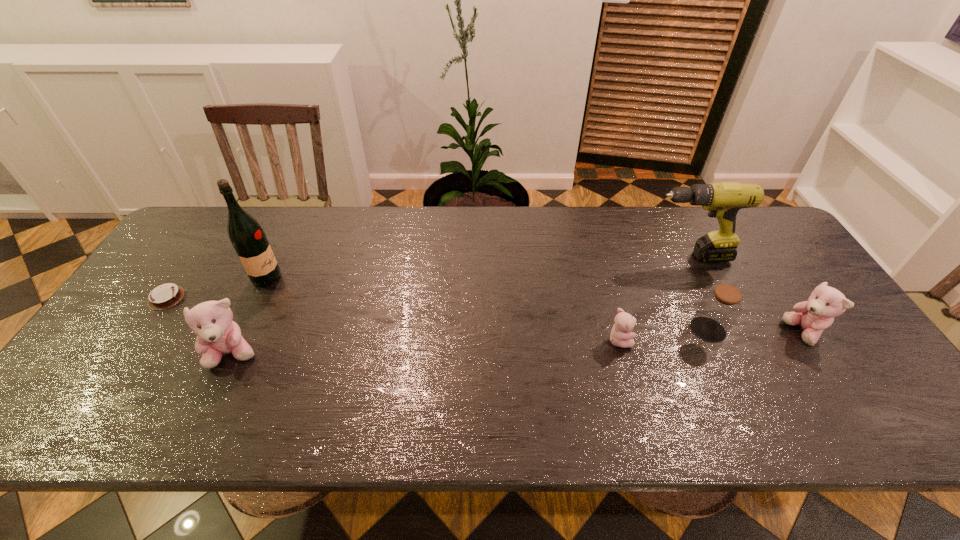
At what (x,y) coordinates should I click in order to perform the action: click on jar. Please return your answer as a coordinate pair (x, y). The height and width of the screenshot is (540, 960). Looking at the image, I should click on (719, 309).

At what (x,y) coordinates should I click in order to perform the action: click on vacant space located at the face of the leftmost teddy bear. Please return your answer as a coordinate pair (x, y). Looking at the image, I should click on click(214, 396).

The image size is (960, 540). Find the location of `blank space located at the face of the second teddy bear from left to right`. blank space located at the face of the second teddy bear from left to right is located at coordinates (726, 340).

This screenshot has height=540, width=960. I want to click on free spot located at the face of the rightmost teddy bear, so click(637, 333).

Where is `vacant space located at the face of the rightmost teddy bear`? The width and height of the screenshot is (960, 540). vacant space located at the face of the rightmost teddy bear is located at coordinates (649, 333).

I want to click on free space located at the face of the rightmost teddy bear, so click(739, 333).

Locate an element on the screen. free space located 0.380m on the front-facing side of the liquor is located at coordinates (413, 278).

Locate an element on the screen. free spot located on the handle side of the drill is located at coordinates (549, 256).

The width and height of the screenshot is (960, 540). What are the coordinates of `free space located 0.210m on the handle side of the drill` in the screenshot? It's located at (575, 256).

Where is `free space located 0.360m on the handle side of the drill`? free space located 0.360m on the handle side of the drill is located at coordinates (526, 256).